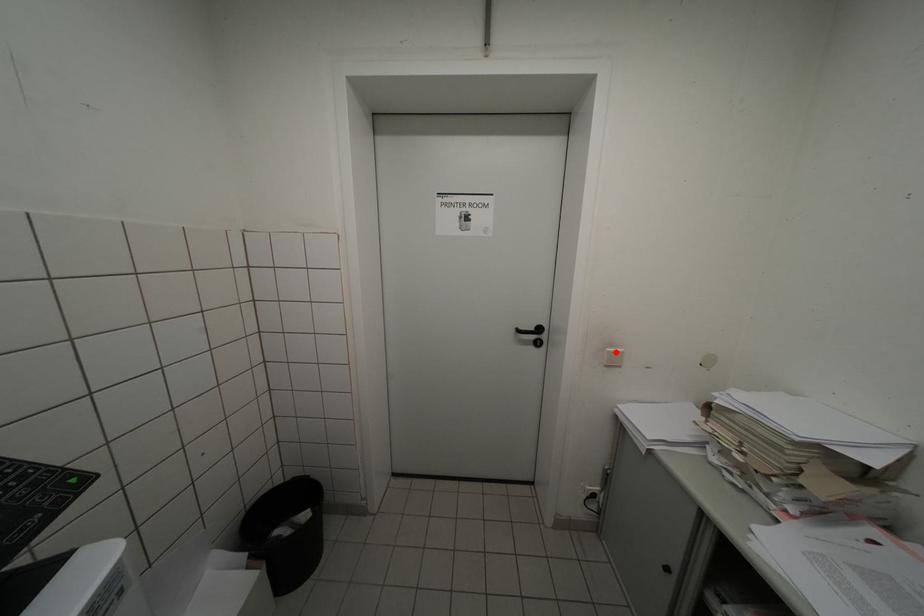
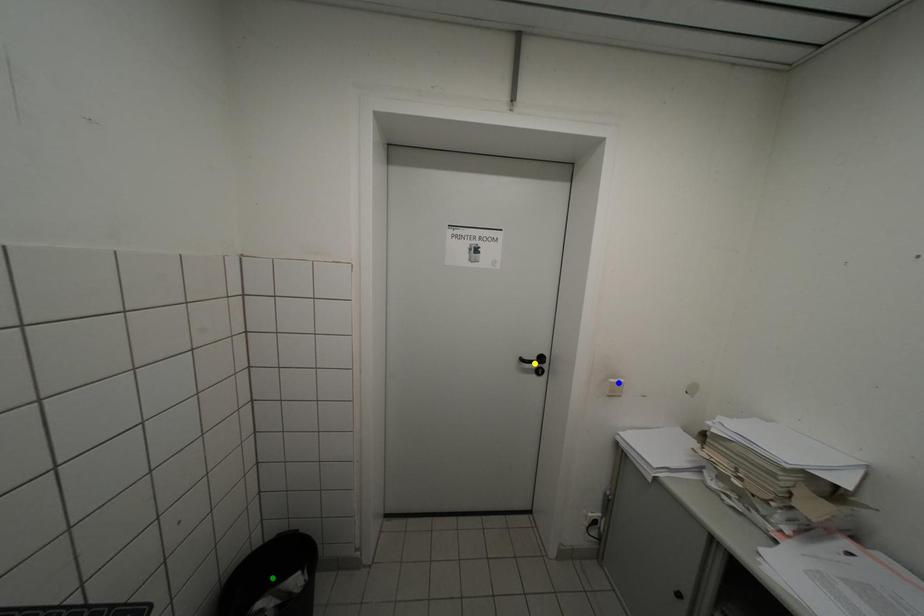
Question: I am providing you with two images of the same scene from different viewpoints. A red point is marked on the first image. You are given multiple points on the second image. In image 2, which mark is for the same physical point as the one in image 1?

Choices:
 (A) yellow point
 (B) green point
 (C) blue point

Answer: (C)